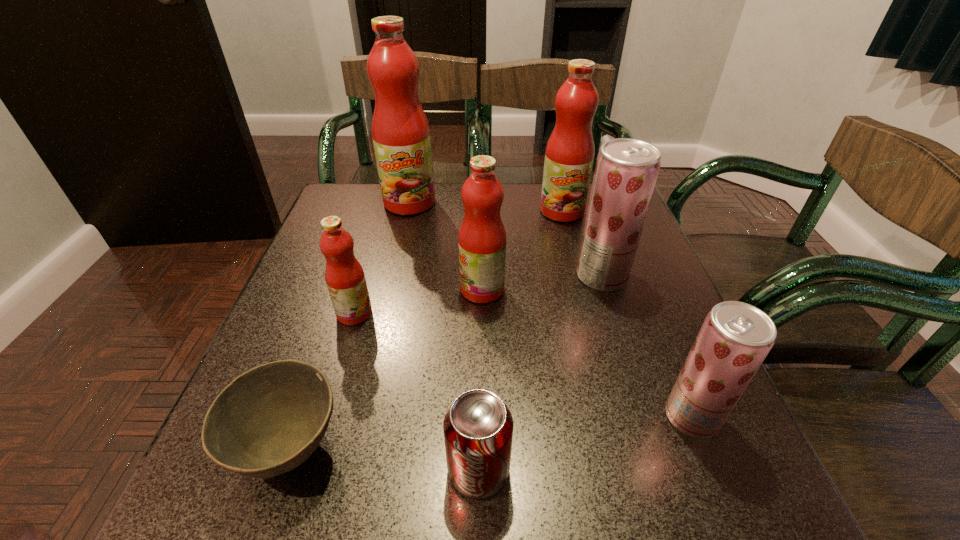
The image size is (960, 540). Find the location of `free spot located on the left of the soda can`. free spot located on the left of the soda can is located at coordinates (292, 470).

The image size is (960, 540). I want to click on free spot located on the back of the shortest object, so click(324, 350).

The image size is (960, 540). I want to click on soda can present at the near edge, so click(x=478, y=427).

Identify the location of bowl that is at the near edge. (270, 419).

I want to click on bowl at the left edge, so click(x=270, y=419).

This screenshot has width=960, height=540. I want to click on object positioned at the far left corner, so click(401, 137).

Find the location of a particular element. The height and width of the screenshot is (540, 960). object that is positioned at the near left corner is located at coordinates (270, 419).

Find the location of a particular element. object at the far right corner is located at coordinates (569, 156).

Identify the location of free location at the far edge. (510, 201).

The image size is (960, 540). In order to click on vacant space at the near edge in this screenshot , I will do `click(403, 487)`.